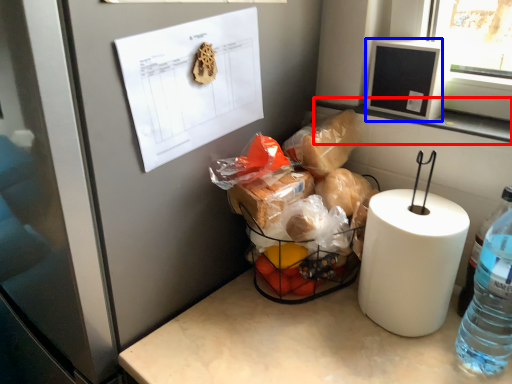
Question: Which object appears closest to the camera in this image, window sill (highlighted by a red box) or window screen (highlighted by a blue box)?

Choices:
 (A) window sill
 (B) window screen

Answer: (A)